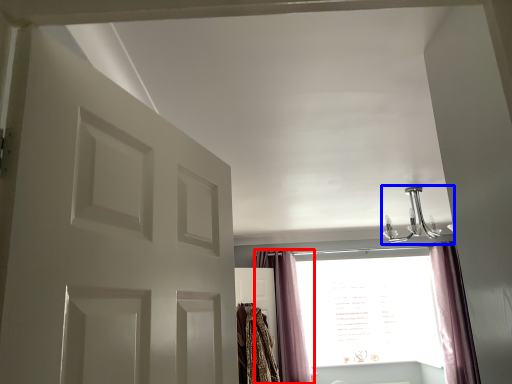
Question: Which object is closer to the camera taking this photo, curtain (highlighted by a red box) or light fixture (highlighted by a blue box)?

Choices:
 (A) curtain
 (B) light fixture

Answer: (B)